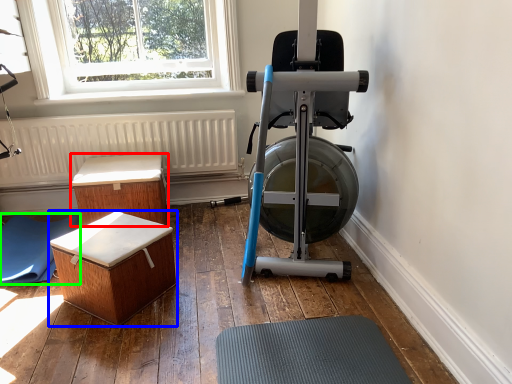
Question: Considering the real-world distances, which object is farthest from furniture (highlighted by a red box)? furniture (highlighted by a blue box) or yoga mat (highlighted by a green box)?

Choices:
 (A) furniture
 (B) yoga mat

Answer: (A)